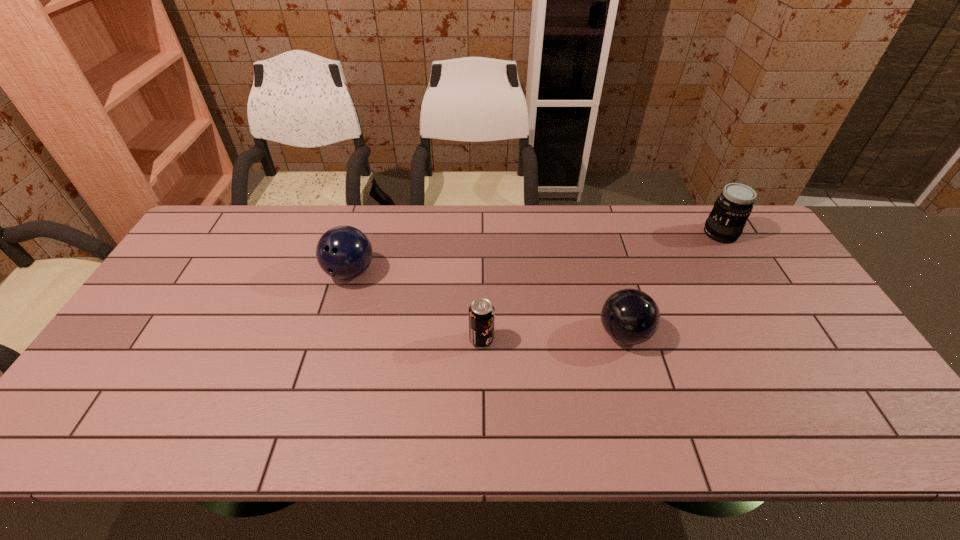
Find the location of `free space located on the side of the second object from right to left with the finger holes`. free space located on the side of the second object from right to left with the finger holes is located at coordinates click(447, 334).

In order to click on vacant space located 0.070m on the side of the second object from right to left with the finger holes in this screenshot , I will do `click(571, 334)`.

This screenshot has width=960, height=540. What are the coordinates of `free space located 0.290m on the left of the soda can` in the screenshot? It's located at (359, 340).

Image resolution: width=960 pixels, height=540 pixels. Identify the location of object at the far edge. (725, 223).

What are the coordinates of `object located at the right edge` in the screenshot? It's located at (725, 223).

Identify the location of object that is at the far right corner. The height and width of the screenshot is (540, 960). (725, 223).

In the image, there is a desktop. Identify the location of vacant space at the far edge. (468, 239).

Find the location of a particular element. This screenshot has height=540, width=960. vacant space at the near edge of the desktop is located at coordinates (310, 436).

I want to click on vacant space at the left edge of the desktop, so click(x=180, y=301).

Where is `vacant space at the right edge`? The image size is (960, 540). vacant space at the right edge is located at coordinates (732, 258).